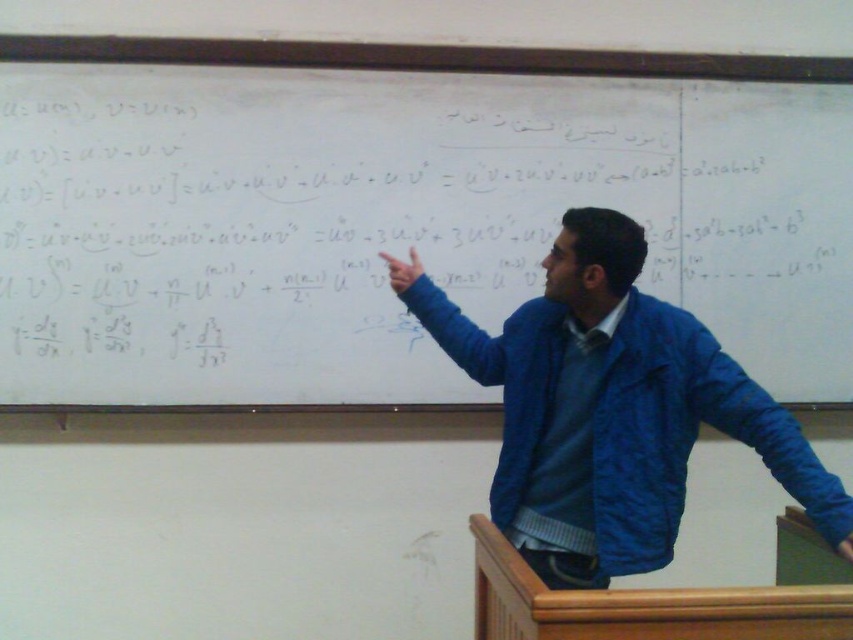
Question: Does white matte board at center have a greater width compared to blue fabric jacket at upper center?

Choices:
 (A) yes
 (B) no

Answer: (A)

Question: Which object appears closest to the camera in this image?

Choices:
 (A) white matte board at center
 (B) blue fabric jacket at upper center

Answer: (B)

Question: Which of the following is the farthest from the observer?

Choices:
 (A) white matte board at center
 (B) blue fabric jacket at upper center

Answer: (A)

Question: Does white matte board at center appear under blue fabric jacket at upper center?

Choices:
 (A) no
 (B) yes

Answer: (A)

Question: Can you confirm if white matte board at center is positioned below blue fabric jacket at upper center?

Choices:
 (A) yes
 (B) no

Answer: (B)